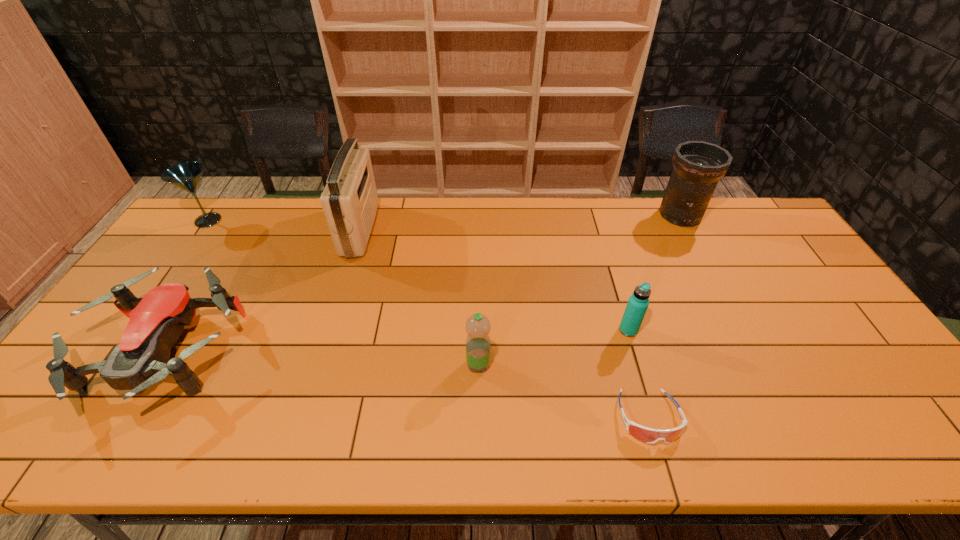
This screenshot has width=960, height=540. Identify the location of drone at the left edge. (141, 359).

This screenshot has height=540, width=960. In order to click on object at the far left corner in this screenshot , I will do `click(186, 175)`.

Where is `object at the near left corner`? This screenshot has height=540, width=960. object at the near left corner is located at coordinates (141, 359).

This screenshot has height=540, width=960. I want to click on blank area at the far edge, so click(x=575, y=231).

Locate an element on the screen. free space at the near edge of the desktop is located at coordinates pos(708,415).

In the image, there is a desktop. Where is `vacant space at the far right corner`? This screenshot has height=540, width=960. vacant space at the far right corner is located at coordinates (751, 232).

Locate an element on the screen. The width and height of the screenshot is (960, 540). free spot between the second shortest object and the rightmost object is located at coordinates (x=422, y=284).

Locate an element on the screen. The width and height of the screenshot is (960, 540). empty location between the sixth tallest object and the shortest object is located at coordinates (407, 384).

Locate an element on the screen. This screenshot has width=960, height=540. unoccupied position between the right water bottle and the drone is located at coordinates point(397,341).

You are a GUI agent. You are given a task and a screenshot of the screen. Output one action in this format:
    pyautogui.click(x=<x>, y=<y>)
    Task: Click on the vacant space that's between the farther water bottle and the radio receiver
    
    Given the screenshot: What is the action you would take?
    pyautogui.click(x=494, y=280)